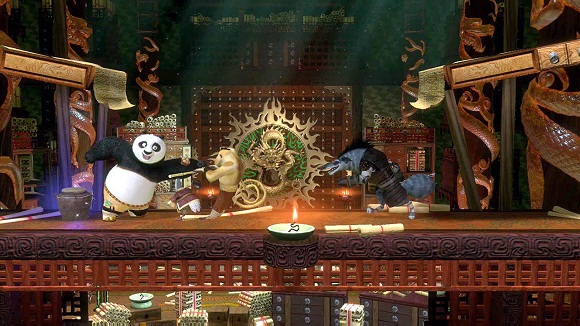
At what (x,y) coordinates should I click in order to perform the action: click on scrolls up on a back shelf. Please return your answer as a coordinate pair (x, y). The image size is (580, 326). Looking at the image, I should click on (277, 16).